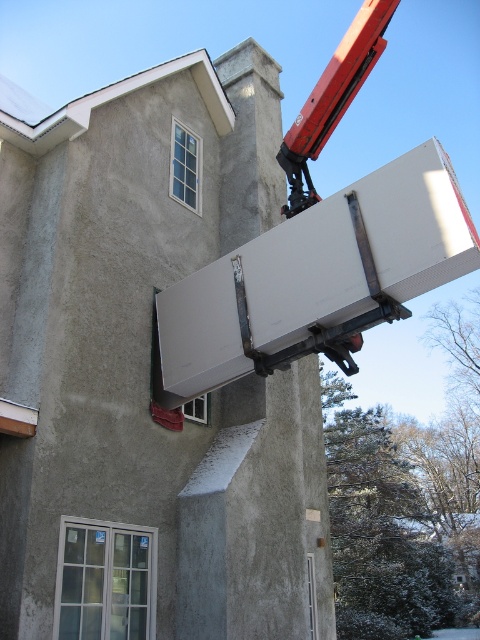
You are an engineer observing the construction site. The white matte refrigerator at upper center needs to be moved to a storage area. Can you safely lower it using the metallic red crane at upper right without damaging the crane or the refrigerator?

The white matte refrigerator at upper center is positioned under the metallic red crane at upper right, so the crane can safely lower it without any obstruction. The operation should be feasible as long as the crane is properly calibrated and the lifting mechanism is secure.

You are an architect reviewing a construction blueprint. The blueprint shows a white matte refrigerator at upper center. According to the coordinates provided, where exactly is the white matte refrigerator located in the blueprint?

The white matte refrigerator at upper center is located at the 2D coordinates point [316,275].